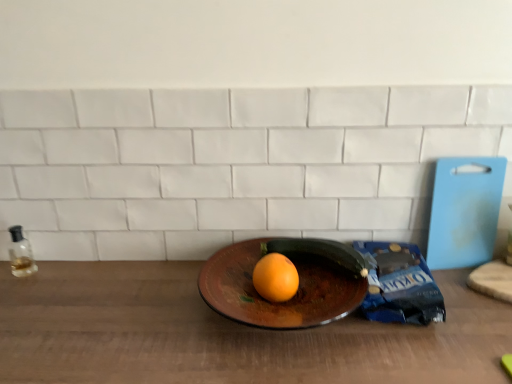
Find the location of a particular element. free location to the left of green matte zucchini at center is located at coordinates (232, 268).